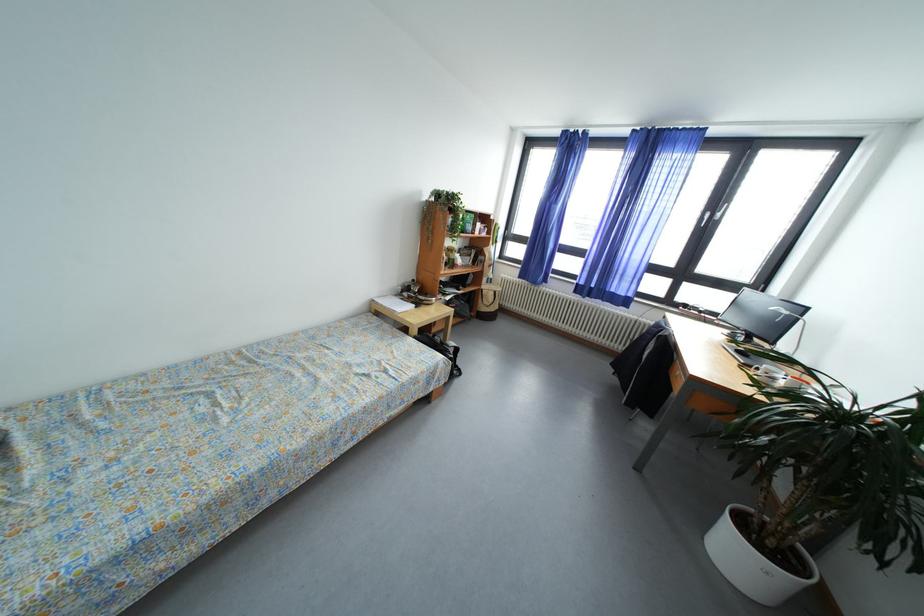
Where would you lift the white mug? Please return your answer as a coordinate pair (x, y).

(755, 562)